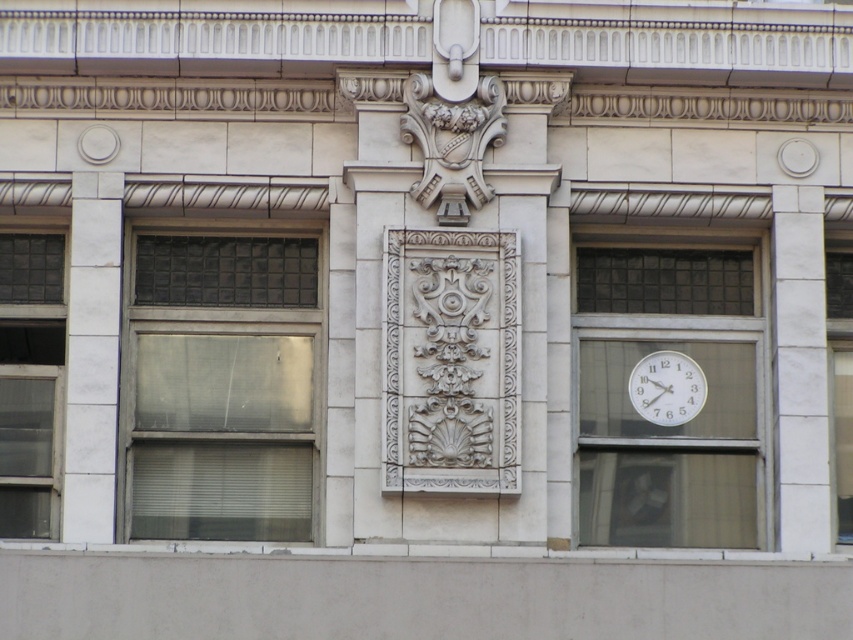
You are standing in front of the building and want to take a photo of the white glass clock at right and the clear glass window at left. Which object will appear larger in your photo?

The white glass clock at right will appear larger in the photo because it is closer to you than the clear glass window at left.

You are an architect analyzing the building facade. You notice the matte glass window at left and the white glossy clock at upper right. Which object is wider?

The white glossy clock at upper right is wider than the matte glass window at left.

You are an architect analyzing the building facade. You need to determine the spatial relationship between the white glass clock at right and the clear glass window at left. Which object is located to the right of the other?

The white glass clock at right is positioned on the right side of the clear glass window at left, meaning the white glass clock at right is to the right of the clear glass window at left.